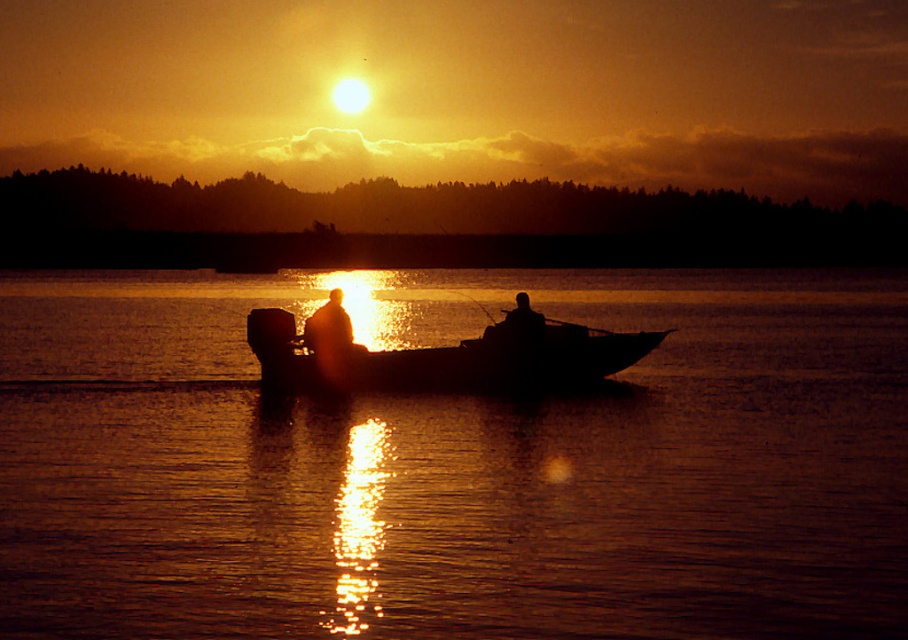
You are an observer standing on the shore looking at the silky water at center and the silhouette wooden boat at center. Which object is higher in the image?

The silky water at center is above the silhouette wooden boat at center, so it is higher in the image.

Consider the image. You are a photographer planning to capture the sunset scene. You want to ensure that both the silky water at center and the silhouette wooden boat at center are clearly visible in your shot. Based on their relative sizes in the image, which object should appear larger in the final photograph?

The silky water at center is much taller than the silhouette wooden boat at center, so it should appear larger in the photograph.